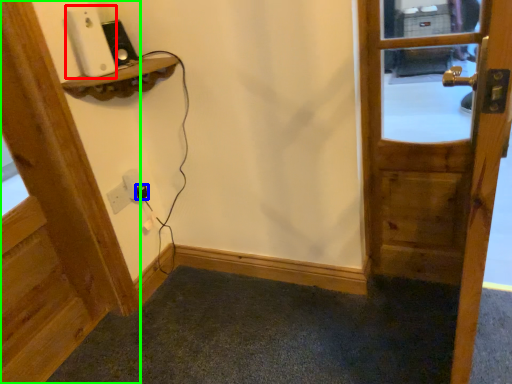
Question: Based on their relative distances, which object is farther from ipod (highlighted by a red box)? Choose from plug (highlighted by a blue box) and door (highlighted by a green box).

Choices:
 (A) plug
 (B) door

Answer: (A)